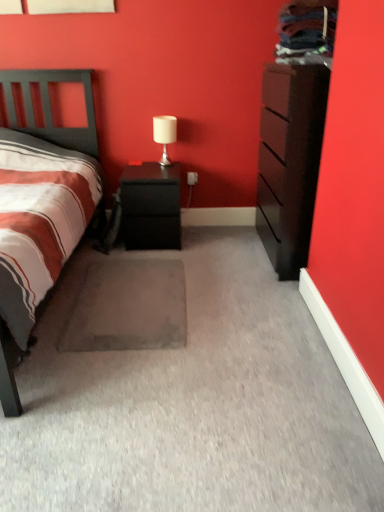
Question: Considering the relative positions of gray carpet at center and black matte nightstand at center in the image provided, is gray carpet at center to the left or to the right of black matte nightstand at center?

Choices:
 (A) right
 (B) left

Answer: (B)

Question: Considering their positions, is gray carpet at center located in front of or behind black matte nightstand at center?

Choices:
 (A) behind
 (B) front

Answer: (B)

Question: Which object is positioned farthest from the gray carpet at center?

Choices:
 (A) white matte table lamp at upper center
 (B) dark brown wood chest of drawers at right
 (C) black matte nightstand at center

Answer: (A)

Question: Which of these objects is positioned farthest from the black matte nightstand at center?

Choices:
 (A) gray carpet at center
 (B) white matte table lamp at upper center
 (C) dark brown wood chest of drawers at right

Answer: (C)